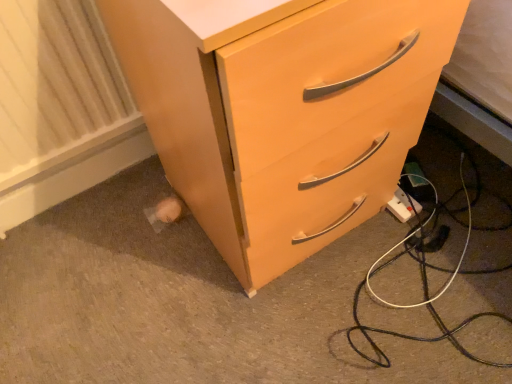
Question: From the image's perspective, is matte wood chest of drawers at center positioned above or below white textured radiator at lower left?

Choices:
 (A) above
 (B) below

Answer: (A)

Question: Is matte wood chest of drawers at center bigger or smaller than white textured radiator at lower left?

Choices:
 (A) big
 (B) small

Answer: (A)

Question: Which object is the farthest from the matte wood chest of drawers at center?

Choices:
 (A) white plastic power strip at lower right
 (B) white textured radiator at lower left

Answer: (A)

Question: Which object is positioned farthest from the white plastic power strip at lower right?

Choices:
 (A) white textured radiator at lower left
 (B) matte wood chest of drawers at center

Answer: (A)